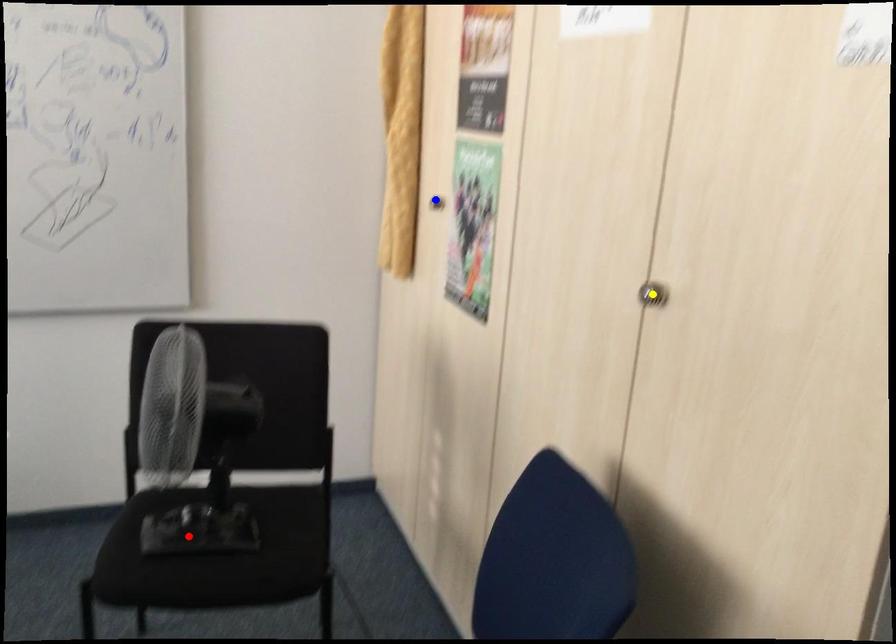
Order these from nearest to farthest:
yellow point, blue point, red point

yellow point, red point, blue point